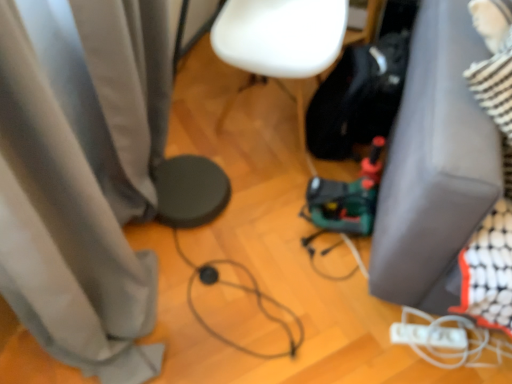
The image size is (512, 384). What are the coordinates of `vacant space that is to the left of white matte wii controller at lower right` in the screenshot? It's located at (368, 338).